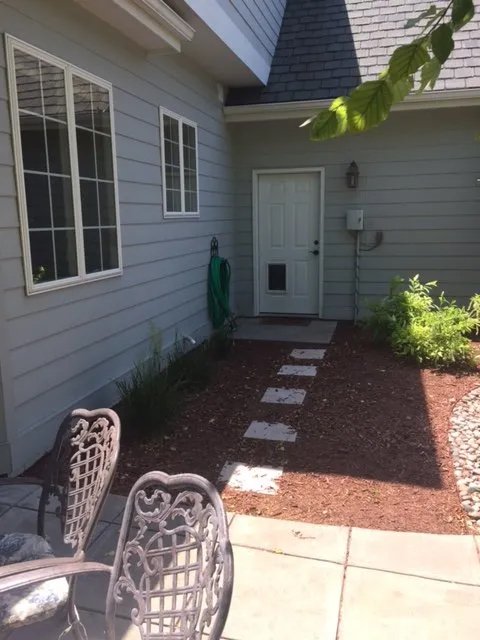
Locate an element on the screen. The image size is (480, 640). rear leg of the chair is located at coordinates (80, 630).